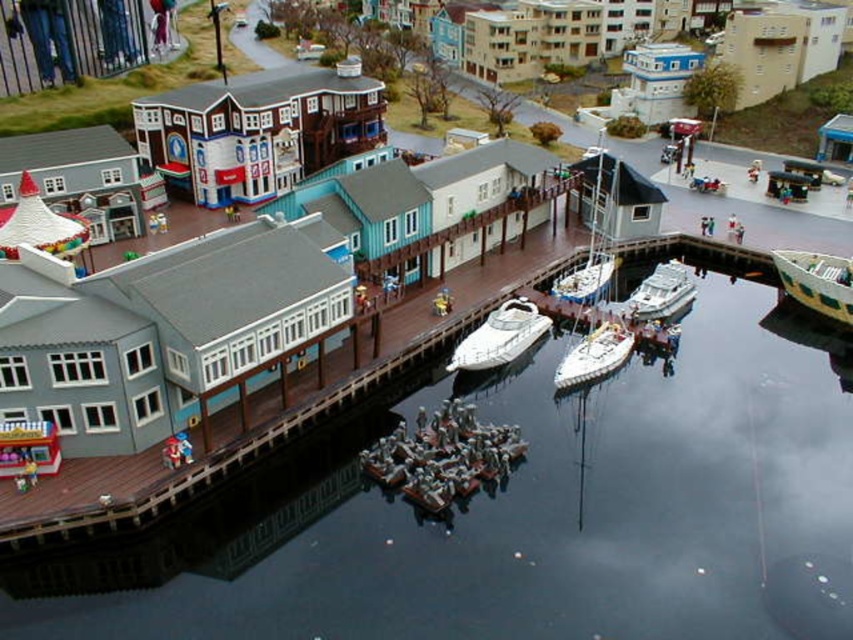
Question: Which of the following is the farthest from the observer?

Choices:
 (A) (508, 550)
 (B) (569, 378)

Answer: (B)

Question: In this image, where is white glossy speedboat at center located relative to white matte sailboat at center?

Choices:
 (A) left
 (B) right

Answer: (A)

Question: Among these points, which one is nearest to the camera?

Choices:
 (A) (780, 278)
 (B) (518, 317)

Answer: (B)

Question: Considering the relative positions of white glossy speedboat at center and green matte boat at right in the image provided, where is white glossy speedboat at center located with respect to green matte boat at right?

Choices:
 (A) below
 (B) above

Answer: (A)

Question: Based on their relative distances, which object is farther from the black glossy water at center?

Choices:
 (A) wooden dock at center
 (B) white glossy boat at center
 (C) green matte boat at right

Answer: (C)

Question: In this image, where is black glossy water at center located relative to green matte boat at right?

Choices:
 (A) left
 (B) right

Answer: (A)